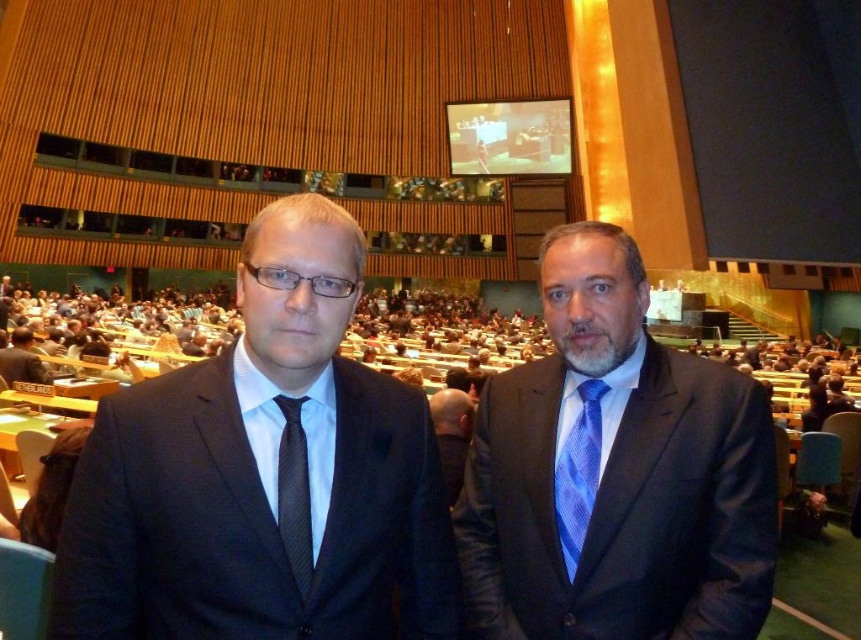
Is blue striped tie at center to the right of black textured tie at center from the viewer's perspective?

Indeed, blue striped tie at center is positioned on the right side of black textured tie at center.

Which is in front, point (546, 586) or point (295, 500)?

Point (295, 500) is in front.

Image resolution: width=861 pixels, height=640 pixels. Identify the location of blue striped tie at center. (615, 474).

Does blue woven tie at right appear over blue silk tie at center?

No, blue woven tie at right is not above blue silk tie at center.

Does blue woven tie at right appear on the left side of blue silk tie at center?

Incorrect, blue woven tie at right is not on the left side of blue silk tie at center.

The height and width of the screenshot is (640, 861). What are the coordinates of `blue woven tie at right` in the screenshot? It's located at (578, 472).

At what (x,y) coordinates should I click in order to perform the action: click on blue woven tie at right. Please return your answer as a coordinate pair (x, y). This screenshot has width=861, height=640. Looking at the image, I should click on (578, 472).

Who is taller, black textured tie at center or matte black suit at left?

black textured tie at center is taller.

Between black textured tie at center and matte black suit at left, which one appears on the right side from the viewer's perspective?

black textured tie at center

Who is more distant from viewer, [288,460] or [34,355]?

Positioned behind is point [34,355].

You are a GUI agent. You are given a task and a screenshot of the screen. Output one action in this format:
    pyautogui.click(x=<x>, y=<y>)
    Task: Click on the black textured tie at center
    The image size is (861, 640).
    Given the screenshot: What is the action you would take?
    pyautogui.click(x=294, y=493)